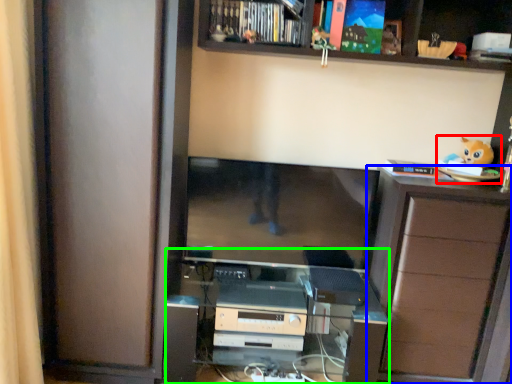
Question: Which is nearer to the toy (highlighted by a red box)? cabinetry (highlighted by a blue box) or entertainment center (highlighted by a green box).

Choices:
 (A) cabinetry
 (B) entertainment center

Answer: (A)